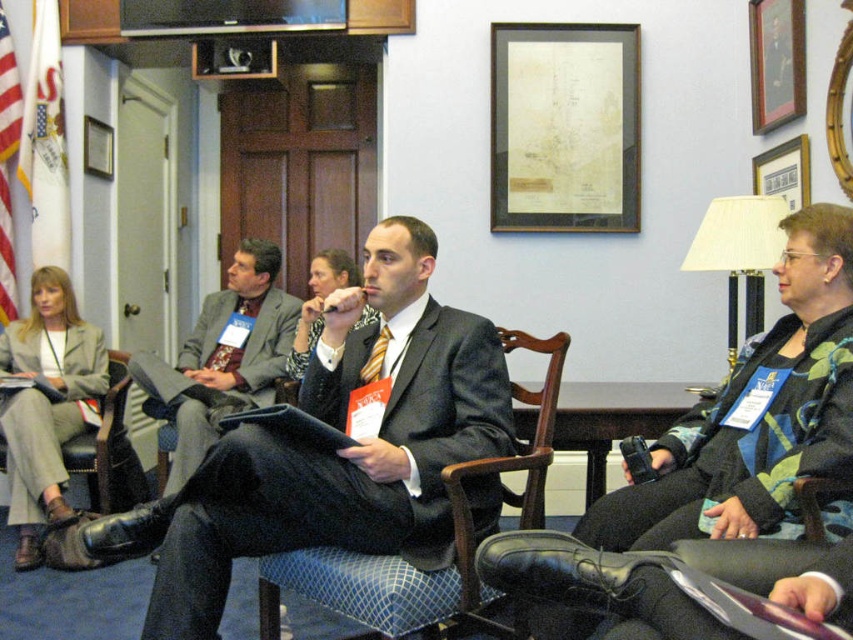
Question: Which point is farther to the camera?

Choices:
 (A) (105, 173)
 (B) (370, 497)
 (C) (792, 141)
 (D) (370, 376)

Answer: (A)

Question: Which of the following is the closest to the observer?

Choices:
 (A) matte black suit at center
 (B) wooden framed portrait at upper right
 (C) dark gray suit at center
 (D) wooden picture frame at upper right

Answer: (A)

Question: From the image, what is the correct spatial relationship of wooden framed portrait at upper right in relation to wooden picture frame at upper left?

Choices:
 (A) below
 (B) above

Answer: (B)

Question: Can you confirm if dark gray suit at center is positioned above wooden picture frame at upper left?

Choices:
 (A) no
 (B) yes

Answer: (A)

Question: Where is black woolen jacket at lower right located in relation to wooden picture frame at upper left in the image?

Choices:
 (A) left
 (B) right

Answer: (B)

Question: Based on their relative distances, which object is farther from the leather armchair at lower left?

Choices:
 (A) black woolen jacket at lower right
 (B) matte black suit at center

Answer: (A)